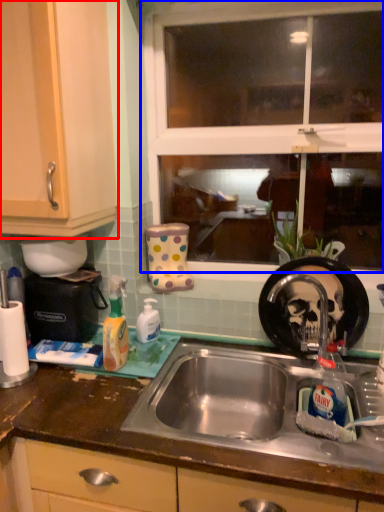
Question: Which point is further to the camera, cabinetry (highlighted by a red box) or window (highlighted by a blue box)?

Choices:
 (A) cabinetry
 (B) window

Answer: (B)